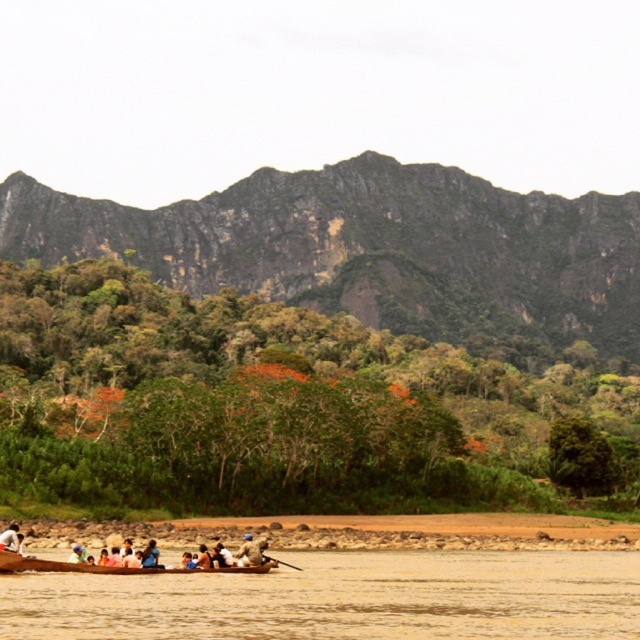
You are a photographer planning to take a photo of the rugged rock mountain at upper center and the white fabric person at lower left. Which object should you focus on first if you want to capture both in a single shot without adjusting your camera zoom?

The rugged rock mountain at upper center is much taller than the white fabric person at lower left, so you should focus on the rugged rock mountain at upper center first to ensure it fits properly in the frame before adjusting for the smaller white fabric person at lower left.

You are standing on the riverside and want to take a photo of both the rugged rock mountain at upper center and the brown leather boat at lower center. Which object should you focus on first to ensure both are in clear view?

You should focus on the rugged rock mountain at upper center first because it is closer to you than the brown leather boat at lower center, ensuring both are in clear view.